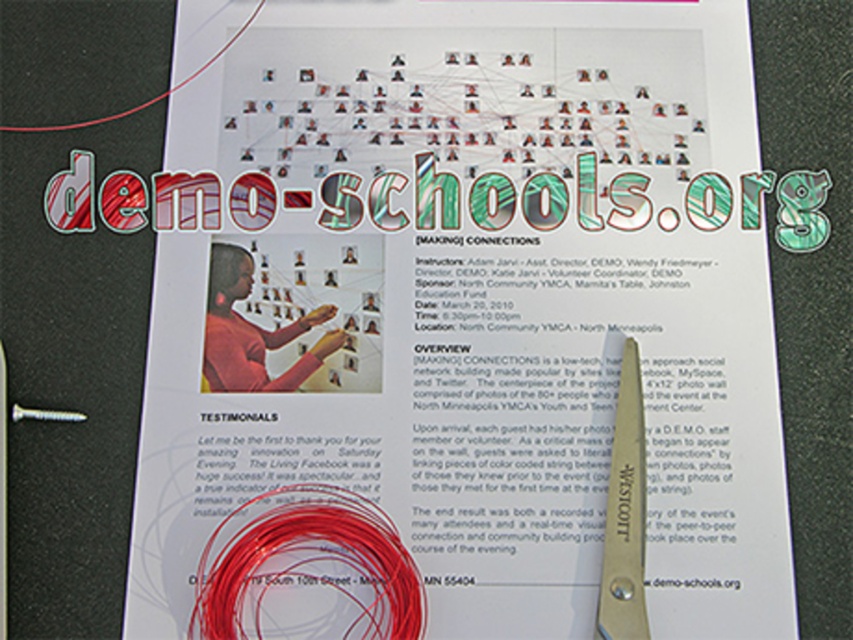
Looking at this image, you need to cut the red string at center but the silver metallic scissors at lower right are in the way. Can you move the scissors to access the string?

The red string at center is located below the silver metallic scissors at lower right, so you can move the scissors to access the string.

You are organizing an event and need to cut the red string at center to attach to a gift. The silver metallic scissors at lower right are the only cutting tool available. Can you reach the scissors without moving the red string?

The red string at center is to the left of the silver metallic scissors at lower right, so you can reach the scissors without moving the red string as they are positioned to the right of the string.

You are holding a printed document and want to fold it so that the point at (248, 595) and the point at (621, 394) align perfectly. Which point should you fold towards the other to make them meet?

Point (248, 595) is closer to the camera than point (621, 394). To align them, fold the document so that the farther point (621, 394) moves toward the closer point (248, 595).